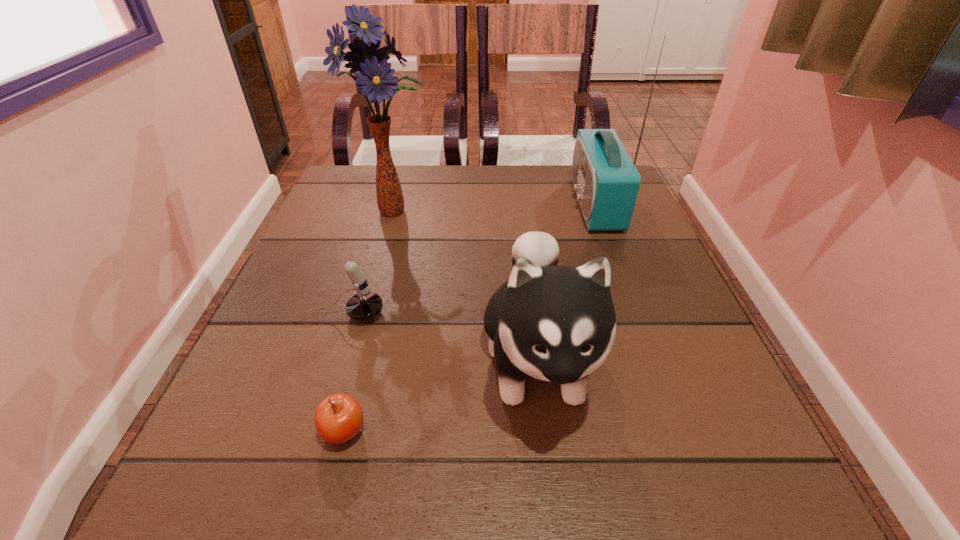
At what (x,y) coordinates should I click in order to perform the action: click on free region at the near right corner of the desktop. Please return your answer as a coordinate pair (x, y). This screenshot has height=540, width=960. Looking at the image, I should click on (687, 478).

Locate an element on the screen. The height and width of the screenshot is (540, 960). vacant point located between the puppy and the shortest object is located at coordinates (441, 395).

Identify the location of unoccupied area between the apple and the rightmost object. This screenshot has height=540, width=960. (470, 318).

Find the location of a particular element. Image resolution: width=960 pixels, height=540 pixels. vacant space that is in between the flower arrangement and the shortest object is located at coordinates (370, 321).

This screenshot has width=960, height=540. I want to click on empty location between the shortest object and the flower arrangement, so click(370, 321).

Identify the location of blank region between the apple and the second object from right to left. (441, 395).

At what (x,y) coordinates should I click in order to perform the action: click on vacant space that is in between the apple and the second shortest object. Please return your answer as a coordinate pair (x, y). This screenshot has width=960, height=540. Looking at the image, I should click on (342, 373).

Image resolution: width=960 pixels, height=540 pixels. Identify the location of free area in between the fourth tallest object and the radio receiver. (468, 259).

Find the location of a particular element. This screenshot has height=540, width=960. empty space that is in between the flower arrangement and the shortest object is located at coordinates (370, 321).

Locate an element on the screen. free space between the puppy and the microphone is located at coordinates (439, 336).